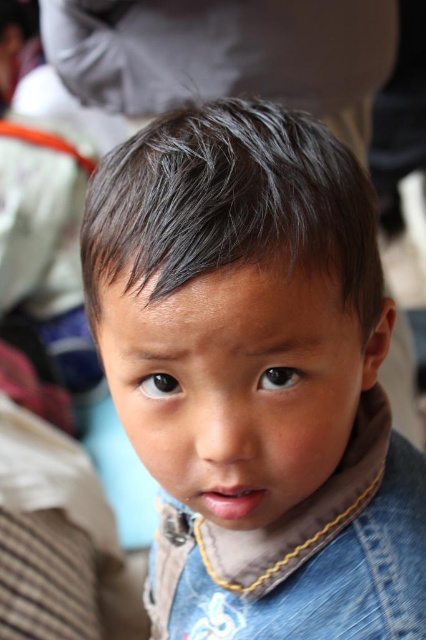
Question: Is the position of brown fuzzy hair at center more distant than that of denim jacket at lower right?

Choices:
 (A) yes
 (B) no

Answer: (B)

Question: Estimate the real-world distances between objects in this image. Which object is closer to the dark brown hair at center?

Choices:
 (A) brown fuzzy hair at center
 (B) denim jacket at lower right

Answer: (A)

Question: Which object appears closest to the camera in this image?

Choices:
 (A) dark brown hair at center
 (B) denim jacket at lower right

Answer: (A)

Question: Is brown fuzzy hair at center to the right of dark brown hair at center from the viewer's perspective?

Choices:
 (A) yes
 (B) no

Answer: (A)

Question: Which of the following is the farthest from the observer?

Choices:
 (A) (x=158, y=227)
 (B) (x=359, y=592)

Answer: (B)

Question: Does brown fuzzy hair at center appear over denim jacket at lower right?

Choices:
 (A) no
 (B) yes

Answer: (B)